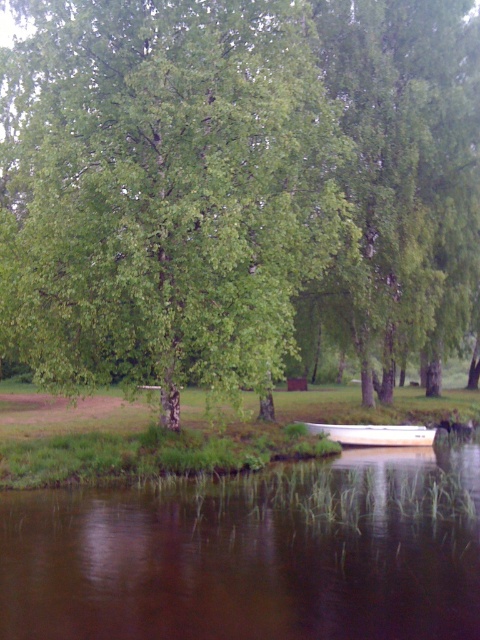
The width and height of the screenshot is (480, 640). Describe the element at coordinates (171, 189) in the screenshot. I see `green leafy tree at center` at that location.

Does green leafy tree at center appear under brown murky water at lower center?

No, green leafy tree at center is not below brown murky water at lower center.

Locate an element on the screen. The height and width of the screenshot is (640, 480). green leafy tree at center is located at coordinates (171, 189).

Which is behind, point (409, 531) or point (313, 426)?

Positioned behind is point (313, 426).

Between brown murky water at lower center and white plastic boat at lower center, which one is positioned lower?

Positioned lower is white plastic boat at lower center.

What do you see at coordinates (253, 554) in the screenshot? This screenshot has height=640, width=480. I see `brown murky water at lower center` at bounding box center [253, 554].

Locate an element on the screen. This screenshot has height=640, width=480. brown murky water at lower center is located at coordinates (253, 554).

Is green leafy tree at center positioned behind white plastic boat at lower center?

No, green leafy tree at center is closer to the viewer.

Is green leafy tree at center bigger than white plastic boat at lower center?

Yes, green leafy tree at center is bigger than white plastic boat at lower center.

The image size is (480, 640). Identify the location of green leafy tree at center. (171, 189).